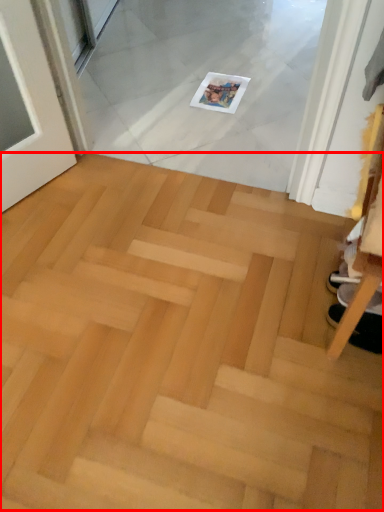
Question: From the image's perspective, where is stairwell (annotated by the red box) located relative to footwear?

Choices:
 (A) below
 (B) above

Answer: (A)